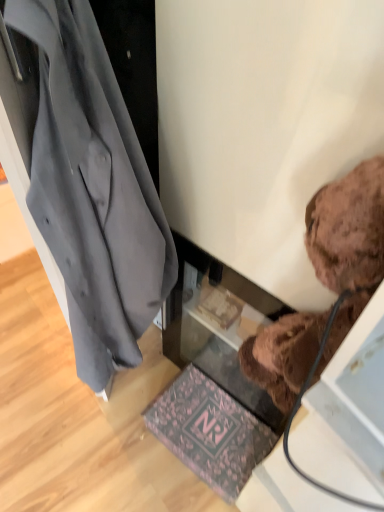
I want to click on blank space situated above pink floral mat at lower center (from a real-world perspective), so click(x=208, y=428).